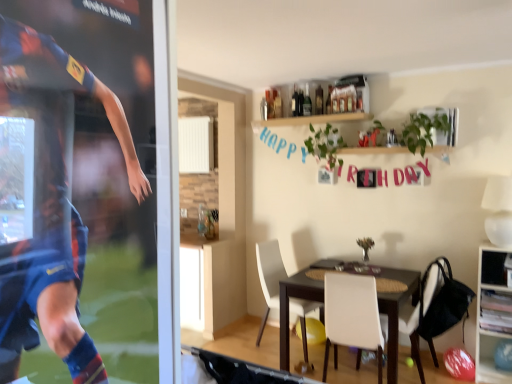
What do you see at coordinates (352, 317) in the screenshot?
I see `white matte chair at center, which appears as the 2th chair when viewed from the right` at bounding box center [352, 317].

What do you see at coordinates (480, 314) in the screenshot? The height and width of the screenshot is (384, 512). I see `wooden cabinet at right` at bounding box center [480, 314].

What is the approximate height of wooden cabinet at right?

The height of wooden cabinet at right is 1.07 meters.

Identify the location of white matte chair at center, which ranks as the 2th chair in left-to-right order. The image size is (512, 384). coord(352,317).

Between white matte chair at center, placed as the 1th chair when sorted from left to right, and dark brown wooden table at center, which one has larger width?

dark brown wooden table at center.

Based on the photo, can you confirm if white matte chair at center, placed as the 1th chair when sorted from left to right, is smaller than dark brown wooden table at center?

Correct, white matte chair at center, placed as the 1th chair when sorted from left to right, occupies less space than dark brown wooden table at center.

From the picture: Which is more to the left, white matte chair at center, placed as the 1th chair when sorted from left to right, or dark brown wooden table at center?

white matte chair at center, placed as the 1th chair when sorted from left to right.

Does white matte chair at center, which appears as the 2th chair when viewed from the right, come in front of wooden cabinet at right?

Yes.

Is wooden cabinet at right surrounded by white matte chair at center, which appears as the 2th chair when viewed from the right?

No.

Between white matte chair at center, which appears as the 2th chair when viewed from the right, and wooden cabinet at right, which one has smaller size?

Smaller between the two is wooden cabinet at right.

Is white matte chair at center, which appears as the 2th chair when viewed from the right, far from wooden cabinet at right?

Yes, white matte chair at center, which appears as the 2th chair when viewed from the right, is far from wooden cabinet at right.

Is dark brown wooden table at center thinner than white matte chair at center, which ranks as the 2th chair in left-to-right order?

No.

Does point (308, 293) come in front of point (354, 305)?

No, it is behind (354, 305).

Can you confirm if dark brown wooden table at center is taller than white matte chair at center, which ranks as the 2th chair in left-to-right order?

No.

Is white matte chair at center, the 1th chair when ordered from right to left, with white matte chair at center, which ranks as the 2th chair in left-to-right order?

white matte chair at center, the 1th chair when ordered from right to left, and white matte chair at center, which ranks as the 2th chair in left-to-right order, are clearly separated.

From the image's perspective, which chair is the 1st one above the white matte chair at center, which ranks as the 2th chair in left-to-right order? Please provide its 2D coordinates.

[(422, 307)]

Looking at this image, from the image's perspective, is white matte chair at center, acting as the third chair starting from the left, positioned above or below white matte chair at center, which appears as the 2th chair when viewed from the right?

white matte chair at center, acting as the third chair starting from the left, is above white matte chair at center, which appears as the 2th chair when viewed from the right.

Is white matte chair at center, the 1th chair when ordered from right to left, situated inside white matte chair at center, which ranks as the 2th chair in left-to-right order, or outside?

white matte chair at center, the 1th chair when ordered from right to left, is spatially situated outside white matte chair at center, which ranks as the 2th chair in left-to-right order.

Between white matte chair at center, which appears as the 2th chair when viewed from the right, and white matte chair at center, the 3th chair in the right-to-left sequence, which one has smaller width?

white matte chair at center, the 3th chair in the right-to-left sequence.

Is white matte chair at center, which appears as the 2th chair when viewed from the right, closer to camera compared to white matte chair at center, placed as the 1th chair when sorted from left to right?

Yes, white matte chair at center, which appears as the 2th chair when viewed from the right, is in front of white matte chair at center, placed as the 1th chair when sorted from left to right.

Between white matte chair at center, which ranks as the 2th chair in left-to-right order, and white matte chair at center, the 3th chair in the right-to-left sequence, which one appears on the right side from the viewer's perspective?

From the viewer's perspective, white matte chair at center, which ranks as the 2th chair in left-to-right order, appears more on the right side.

Considering the sizes of objects white matte chair at center, which appears as the 2th chair when viewed from the right, and white matte chair at center, placed as the 1th chair when sorted from left to right, in the image provided, who is taller, white matte chair at center, which appears as the 2th chair when viewed from the right, or white matte chair at center, placed as the 1th chair when sorted from left to right,?

With more height is white matte chair at center, placed as the 1th chair when sorted from left to right.

From the image's perspective, is white matte chair at center, placed as the 1th chair when sorted from left to right, located above white matte chair at center, the 1th chair when ordered from right to left?

Yes, from the image's perspective, white matte chair at center, placed as the 1th chair when sorted from left to right, is over white matte chair at center, the 1th chair when ordered from right to left.

Based on the photo, considering the sizes of white matte chair at center, the 3th chair in the right-to-left sequence, and white matte chair at center, the 1th chair when ordered from right to left, in the image, is white matte chair at center, the 3th chair in the right-to-left sequence, wider or thinner than white matte chair at center, the 1th chair when ordered from right to left,?

Considering their sizes, white matte chair at center, the 3th chair in the right-to-left sequence, looks slimmer than white matte chair at center, the 1th chair when ordered from right to left.

From a real-world perspective, is white matte chair at center, the 3th chair in the right-to-left sequence, over white matte chair at center, the 1th chair when ordered from right to left?

Yes, from a real-world perspective, white matte chair at center, the 3th chair in the right-to-left sequence, is on top of white matte chair at center, the 1th chair when ordered from right to left.

Who is more distant, white matte chair at center, the 3th chair in the right-to-left sequence, or white matte chair at center, acting as the third chair starting from the left?

white matte chair at center, the 3th chair in the right-to-left sequence.

From the image's perspective, who appears lower, white matte chair at center, the 1th chair when ordered from right to left, or dark brown wooden table at center?

dark brown wooden table at center.

Is white matte chair at center, acting as the third chair starting from the left, with dark brown wooden table at center?

They are not placed beside each other.

In order to click on table that appears below the white matte chair at center, acting as the third chair starting from the left (from a real-world perspective) in this screenshot , I will do `click(396, 311)`.

Is white matte chair at center, acting as the third chair starting from the left, oriented towards dark brown wooden table at center?

Yes, white matte chair at center, acting as the third chair starting from the left, is facing dark brown wooden table at center.

Identify the location of table below the white matte chair at center, placed as the 1th chair when sorted from left to right (from the image's perspective). The width and height of the screenshot is (512, 384). (396, 311).

Locate an element on the screen. The width and height of the screenshot is (512, 384). cabinetry that appears above the white matte chair at center, which ranks as the 2th chair in left-to-right order (from a real-world perspective) is located at coordinates (480, 314).

Considering their positions, is white matte chair at center, placed as the 1th chair when sorted from left to right, positioned closer to dark brown wooden table at center than white matte chair at center, acting as the third chair starting from the left?

white matte chair at center, acting as the third chair starting from the left, is closer to dark brown wooden table at center.

When comparing their distances from wooden cabinet at right, does white matte chair at center, which appears as the 2th chair when viewed from the right, or white matte chair at center, the 1th chair when ordered from right to left, seem further?

The object further to wooden cabinet at right is white matte chair at center, which appears as the 2th chair when viewed from the right.

Consider the image. From the image, which object appears to be farther from white matte chair at center, acting as the third chair starting from the left, wooden cabinet at right or white matte chair at center, which ranks as the 2th chair in left-to-right order?

white matte chair at center, which ranks as the 2th chair in left-to-right order, lies further to white matte chair at center, acting as the third chair starting from the left, than the other object.

Consider the image. When comparing their distances from white matte chair at center, acting as the third chair starting from the left, does dark brown wooden table at center or white matte chair at center, which ranks as the 2th chair in left-to-right order, seem further?

white matte chair at center, which ranks as the 2th chair in left-to-right order, lies further to white matte chair at center, acting as the third chair starting from the left, than the other object.

Which object lies further to the anchor point wooden cabinet at right, dark brown wooden table at center or white matte chair at center, acting as the third chair starting from the left?

dark brown wooden table at center.

In the scene shown: From the image, which object appears to be nearer to wooden cabinet at right, white matte chair at center, which appears as the 2th chair when viewed from the right, or white matte chair at center, the 3th chair in the right-to-left sequence?

white matte chair at center, which appears as the 2th chair when viewed from the right, lies closer to wooden cabinet at right than the other object.

Considering their positions, is dark brown wooden table at center positioned closer to white matte chair at center, acting as the third chair starting from the left, than white matte chair at center, the 3th chair in the right-to-left sequence?

dark brown wooden table at center is closer to white matte chair at center, acting as the third chair starting from the left.

Consider the image. Considering their positions, is white matte chair at center, the 3th chair in the right-to-left sequence, positioned further to dark brown wooden table at center than wooden cabinet at right?

The object further to dark brown wooden table at center is white matte chair at center, the 3th chair in the right-to-left sequence.

Identify the location of table between white matte chair at center, which ranks as the 2th chair in left-to-right order, and white matte chair at center, acting as the third chair starting from the left. (396, 311).

Image resolution: width=512 pixels, height=384 pixels. What are the coordinates of `chair between white matte chair at center, placed as the 1th chair when sorted from left to right, and white matte chair at center, acting as the third chair starting from the left, from left to right` in the screenshot? It's located at (352, 317).

At what (x,y) coordinates should I click in order to perform the action: click on table situated between white matte chair at center, which appears as the 2th chair when viewed from the right, and wooden cabinet at right from left to right. Please return your answer as a coordinate pair (x, y). The height and width of the screenshot is (384, 512). Looking at the image, I should click on (396, 311).

The image size is (512, 384). In order to click on chair between dark brown wooden table at center and wooden cabinet at right in this screenshot , I will do `click(422, 307)`.